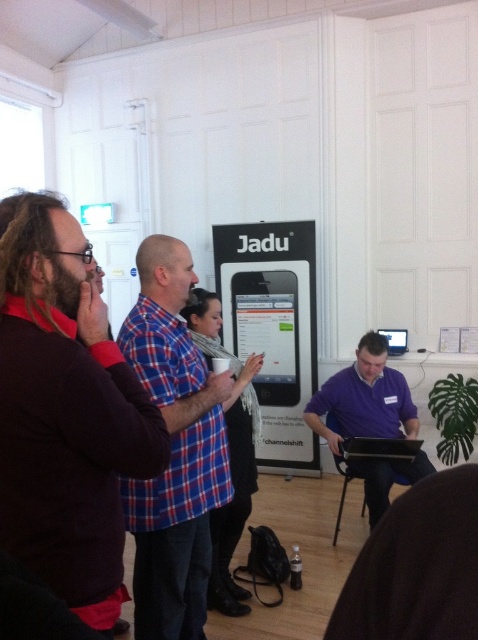
Can you confirm if purple matte shirt at center is smaller than black plastic laptop at center?

Actually, purple matte shirt at center might be larger than black plastic laptop at center.

Can you confirm if purple matte shirt at center is positioned to the left of black plastic laptop at center?

Indeed, purple matte shirt at center is positioned on the left side of black plastic laptop at center.

Which is behind, point (384, 384) or point (380, 440)?

Positioned behind is point (384, 384).

Where is `purple matte shirt at center`? Image resolution: width=478 pixels, height=640 pixels. purple matte shirt at center is located at coordinates (364, 397).

Does dark brown sweater at left have a greater width compared to purple matte shirt at center?

Incorrect, dark brown sweater at left's width does not surpass purple matte shirt at center's.

Does dark brown sweater at left appear over purple matte shirt at center?

Indeed, dark brown sweater at left is positioned over purple matte shirt at center.

Who is more distant from viewer, (13, 484) or (364, 387)?

The point (364, 387) is more distant.

At what (x,y) coordinates should I click in order to perform the action: click on dark brown sweater at left. Please return your answer as a coordinate pair (x, y). This screenshot has width=478, height=640. Looking at the image, I should click on (65, 412).

Looking at this image, who is positioned more to the right, dark brown sweater at left or black plastic laptop at center?

black plastic laptop at center is more to the right.

Measure the distance from dark brown sweater at left to black plastic laptop at center.

A distance of 2.34 meters exists between dark brown sweater at left and black plastic laptop at center.

Between point (85, 452) and point (398, 448), which one is positioned behind?

Positioned behind is point (398, 448).

The image size is (478, 640). Identify the location of dark brown sweater at left. (65, 412).